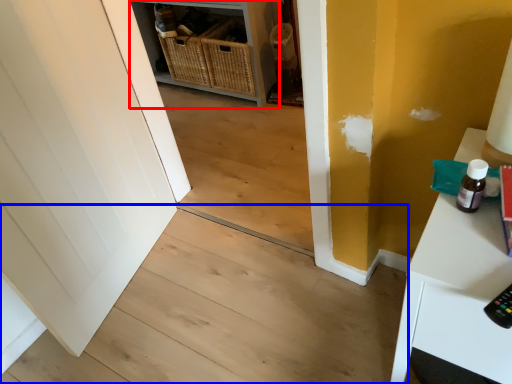
Question: Which object appears closest to the camera in this image, shelf (highlighted by a red box) or stair (highlighted by a blue box)?

Choices:
 (A) shelf
 (B) stair

Answer: (B)